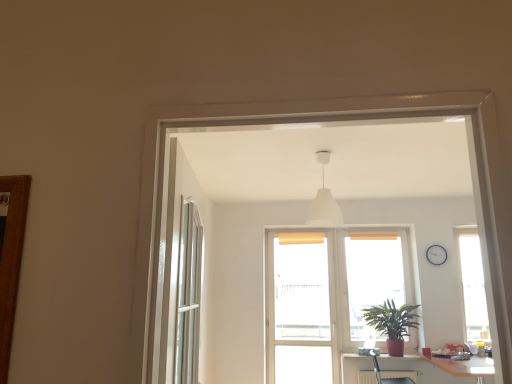
In order to face metallic silver armchair at lower right, should I rotate leftwards or rightwards?

You should look right and rotate roughly 18.138 degrees.

Locate an element on the screen. This screenshot has height=384, width=512. translucent fabric screen at center is located at coordinates (374, 276).

Where is `white plastic clock at upper right`? This screenshot has height=384, width=512. white plastic clock at upper right is located at coordinates (436, 255).

Measure the distance between white plastic clock at upper right and camera.

A distance of 5.50 meters exists between white plastic clock at upper right and camera.

What is the approximate width of green matte plant at lower right?

It is 44.02 centimeters.

You are a GUI agent. You are given a task and a screenshot of the screen. Output one action in this format:
    pyautogui.click(x=<x>, y=<y>)
    Task: Click on the metallic silver armchair at lower right
    
    Given the screenshot: What is the action you would take?
    pyautogui.click(x=387, y=377)

From a real-world perspective, which object stands above the other?

In real-world perspective, translucent fabric screen at center is above.

Considering the sizes of objects translucent fabric screen at center and green matte plant at lower right in the image provided, who is taller, translucent fabric screen at center or green matte plant at lower right?

translucent fabric screen at center.

In terms of size, does translucent fabric screen at center appear bigger or smaller than green matte plant at lower right?

translucent fabric screen at center is smaller than green matte plant at lower right.

Would you say translucent plastic screen door at center contains white glossy table at lower right?

No, white glossy table at lower right is located outside of translucent plastic screen door at center.

Between translucent plastic screen door at center and white glossy table at lower right, which one is positioned behind?

translucent plastic screen door at center is further from the camera.

Does translucent plastic screen door at center have a greater width compared to white glossy table at lower right?

No, translucent plastic screen door at center is not wider than white glossy table at lower right.

Considering the relative sizes of translucent plastic screen door at center and white glossy table at lower right in the image provided, is translucent plastic screen door at center shorter than white glossy table at lower right?

No.

Considering the positions of objects green matte plant at lower right and white matte lampshade at center in the image provided, who is more to the left, green matte plant at lower right or white matte lampshade at center?

white matte lampshade at center is more to the left.

Is green matte plant at lower right next to white matte lampshade at center?

There is a gap between green matte plant at lower right and white matte lampshade at center.

Does green matte plant at lower right have a lesser width compared to white matte lampshade at center?

No, green matte plant at lower right is not thinner than white matte lampshade at center.

Is green matte plant at lower right taller or shorter than white matte lampshade at center?

Considering their sizes, green matte plant at lower right has less height than white matte lampshade at center.

Is translucent fabric screen at center inside white glossy table at lower right?

No, translucent fabric screen at center is located outside of white glossy table at lower right.

Which of these two, white glossy table at lower right or translucent fabric screen at center, stands shorter?

white glossy table at lower right.

Is white glossy table at lower right smaller than translucent fabric screen at center?

Incorrect, white glossy table at lower right is not smaller in size than translucent fabric screen at center.

Is there a large distance between white glossy table at lower right and translucent fabric screen at center?

Yes.

Measure the distance between translucent fabric screen at center and white glossy table at lower right.

1.10 meters.

Considering the positions of objects translucent fabric screen at center and white glossy table at lower right in the image provided, who is in front, translucent fabric screen at center or white glossy table at lower right?

white glossy table at lower right is in front.

Is translucent fabric screen at center situated inside white glossy table at lower right or outside?

translucent fabric screen at center is spatially situated outside white glossy table at lower right.

Locate an element on the screen. This screenshot has width=512, height=384. window screen located above the green matte plant at lower right (from the image's perspective) is located at coordinates [x=374, y=276].

Is point (408, 324) closer or farther from the camera than point (403, 292)?

Point (408, 324) is closer to the camera than point (403, 292).

Is green matte plant at lower right far from translucent fabric screen at center?

No, green matte plant at lower right is not far away from translucent fabric screen at center.

Is white plastic clock at upper right to the left of white matte lampshade at center from the viewer's perspective?

In fact, white plastic clock at upper right is to the right of white matte lampshade at center.

In the image, is white plastic clock at upper right positioned in front of or behind white matte lampshade at center?

Clearly, white plastic clock at upper right is behind white matte lampshade at center.

From the image's perspective, is white plastic clock at upper right below white matte lampshade at center?

Yes, from the image's perspective, white plastic clock at upper right is beneath white matte lampshade at center.

Does white plastic clock at upper right have a greater height compared to white matte lampshade at center?

No, white plastic clock at upper right is not taller than white matte lampshade at center.

Where is `window screen above the green matte plant at lower right (from a real-world perspective)`? This screenshot has width=512, height=384. window screen above the green matte plant at lower right (from a real-world perspective) is located at coordinates (374, 276).

Locate an element on the screen. table that is below the translucent plastic screen door at center (from the image's perspective) is located at coordinates (464, 366).

When comparing their distances from translucent fabric screen at center, does green matte plant at lower right or white glossy table at lower right seem further?

white glossy table at lower right.

Looking at the image, which one is located further to translucent plastic screen door at center, translucent fabric screen at center or metallic silver armchair at lower right?

metallic silver armchair at lower right is positioned further to the anchor translucent plastic screen door at center.

Looking at the image, which one is located further to white plastic clock at upper right, green matte plant at lower right or translucent fabric screen at center?

green matte plant at lower right lies further to white plastic clock at upper right than the other object.

From the image, which object appears to be nearer to translucent plastic screen door at center, metallic silver armchair at lower right or green matte plant at lower right?

green matte plant at lower right.

When comparing their distances from white matte lampshade at center, does translucent fabric screen at center or white plastic clock at upper right seem further?

white plastic clock at upper right.

Estimate the real-world distances between objects in this image. Which object is further from translucent plastic screen door at center, white matte lampshade at center or translucent fabric screen at center?

The object further to translucent plastic screen door at center is white matte lampshade at center.

From the image, which object appears to be farther from translucent fabric screen at center, white glossy table at lower right or white matte lampshade at center?

white matte lampshade at center.

From the image, which object appears to be farther from translucent plastic screen door at center, translucent fabric screen at center or white matte lampshade at center?

white matte lampshade at center is positioned further to the anchor translucent plastic screen door at center.

This screenshot has width=512, height=384. Identify the location of clock between metallic silver armchair at lower right and translucent fabric screen at center from front to back. (436, 255).

You are a GUI agent. You are given a task and a screenshot of the screen. Output one action in this format:
    pyautogui.click(x=<x>, y=<y>)
    Task: Click on the window screen that lies between white plastic clock at upper right and green matte plant at lower right from top to bottom
    The height and width of the screenshot is (384, 512).
    Given the screenshot: What is the action you would take?
    pyautogui.click(x=374, y=276)

I want to click on armchair located between white glossy table at lower right and white plastic clock at upper right in the depth direction, so click(x=387, y=377).

You are a GUI agent. You are given a task and a screenshot of the screen. Output one action in this format:
    pyautogui.click(x=<x>, y=<y>)
    Task: Click on the houseplant situated between translucent plastic screen door at center and white plastic clock at upper right from left to right
    This screenshot has width=512, height=384.
    Given the screenshot: What is the action you would take?
    pyautogui.click(x=392, y=323)